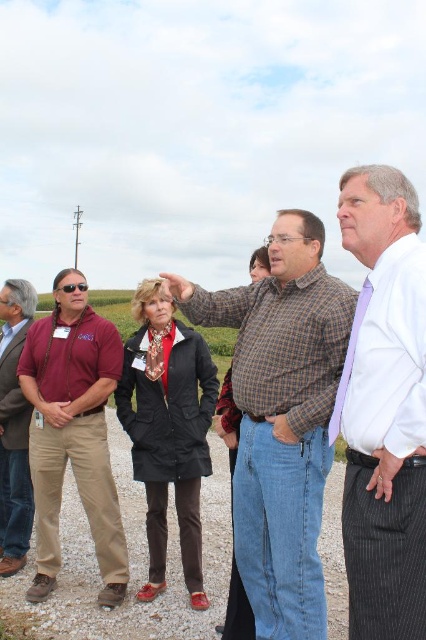
Is point (324, 600) less distant than point (108, 472)?

Yes, it is in front of point (108, 472).

Which is behind, point (296, 308) or point (111, 333)?

The point (111, 333) is behind.

Who is more forward, (285,529) or (98,358)?

Point (285,529) is in front.

Image resolution: width=426 pixels, height=640 pixels. Find the location of `brown checkered shirt at center`. brown checkered shirt at center is located at coordinates (282, 417).

Who is positioned more to the right, white striped shirt at center or matte brown jacket at left?

From the viewer's perspective, white striped shirt at center appears more on the right side.

What do you see at coordinates (383, 408) in the screenshot? The width and height of the screenshot is (426, 640). I see `white striped shirt at center` at bounding box center [383, 408].

Identify the location of white striped shirt at center. The image size is (426, 640). (383, 408).

Is brown checkered shirt at center shorter than matte brown jacket at left?

Incorrect, brown checkered shirt at center's height does not fall short of matte brown jacket at left's.

Between point (325, 634) and point (14, 291), which one is positioned behind?

The point (14, 291) is more distant.

Locate an element on the screen. This screenshot has width=426, height=640. brown checkered shirt at center is located at coordinates (282, 417).